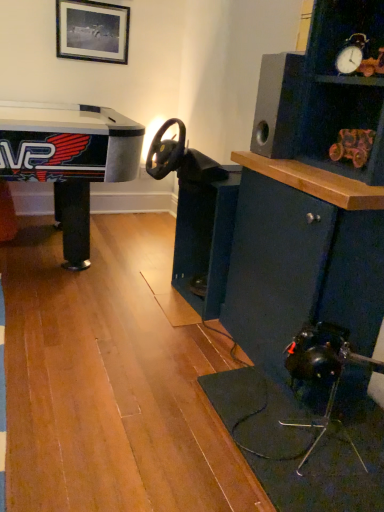
Question: Are black matte speaker at upper right and wooden toy car at upper right located far from each other?

Choices:
 (A) yes
 (B) no

Answer: (B)

Question: Is black matte speaker at upper right shorter than wooden toy car at upper right?

Choices:
 (A) yes
 (B) no

Answer: (B)

Question: Does black matte speaker at upper right turn towards wooden toy car at upper right?

Choices:
 (A) no
 (B) yes

Answer: (A)

Question: Considering the relative positions of black matte speaker at upper right and wooden toy car at upper right in the image provided, is black matte speaker at upper right to the left of wooden toy car at upper right from the viewer's perspective?

Choices:
 (A) yes
 (B) no

Answer: (A)

Question: Does black matte speaker at upper right contain wooden toy car at upper right?

Choices:
 (A) no
 (B) yes

Answer: (A)

Question: In terms of height, does black matte speaker at upper right look taller or shorter compared to black matte picture frame at upper center?

Choices:
 (A) tall
 (B) short

Answer: (A)

Question: In terms of width, does black matte speaker at upper right look wider or thinner when compared to black matte picture frame at upper center?

Choices:
 (A) wide
 (B) thin

Answer: (A)

Question: Visually, is black matte speaker at upper right positioned to the left or to the right of black matte picture frame at upper center?

Choices:
 (A) right
 (B) left

Answer: (A)

Question: Do you think black matte speaker at upper right is within black matte picture frame at upper center, or outside of it?

Choices:
 (A) outside
 (B) inside

Answer: (A)

Question: Is black matte picture frame at upper center taller or shorter than dark blue wood cabinet at center?

Choices:
 (A) short
 (B) tall

Answer: (A)

Question: Is black matte picture frame at upper center in front of or behind dark blue wood cabinet at center in the image?

Choices:
 (A) behind
 (B) front

Answer: (A)

Question: Is black matte picture frame at upper center spatially inside dark blue wood cabinet at center, or outside of it?

Choices:
 (A) outside
 (B) inside

Answer: (A)

Question: Would you say black matte picture frame at upper center is to the left or to the right of dark blue wood cabinet at center in the picture?

Choices:
 (A) right
 (B) left

Answer: (B)

Question: Considering the relative positions of dark blue wood cabinet at center and black matte speaker at upper right in the image provided, is dark blue wood cabinet at center to the left or to the right of black matte speaker at upper right?

Choices:
 (A) right
 (B) left

Answer: (B)

Question: In terms of width, does dark blue wood cabinet at center look wider or thinner when compared to black matte speaker at upper right?

Choices:
 (A) wide
 (B) thin

Answer: (A)